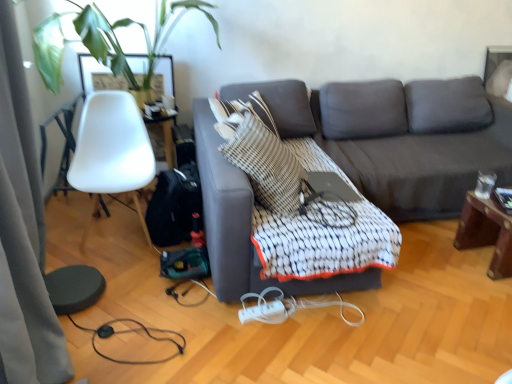
Image resolution: width=512 pixels, height=384 pixels. Find the location of `vacant area located to the right-hand side of white plastic extension cord at lower center`. vacant area located to the right-hand side of white plastic extension cord at lower center is located at coordinates (295, 324).